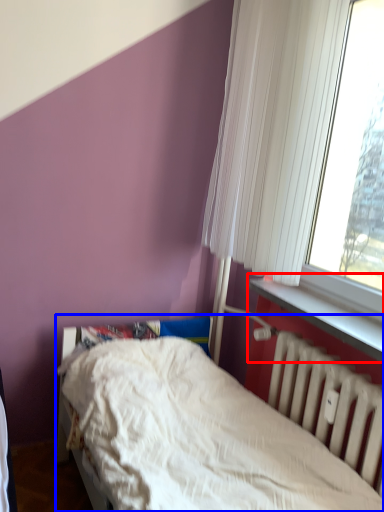
Question: Which of the following is the farthest to the observer, window sill (highlighted by a red box) or bed (highlighted by a blue box)?

Choices:
 (A) window sill
 (B) bed

Answer: (A)